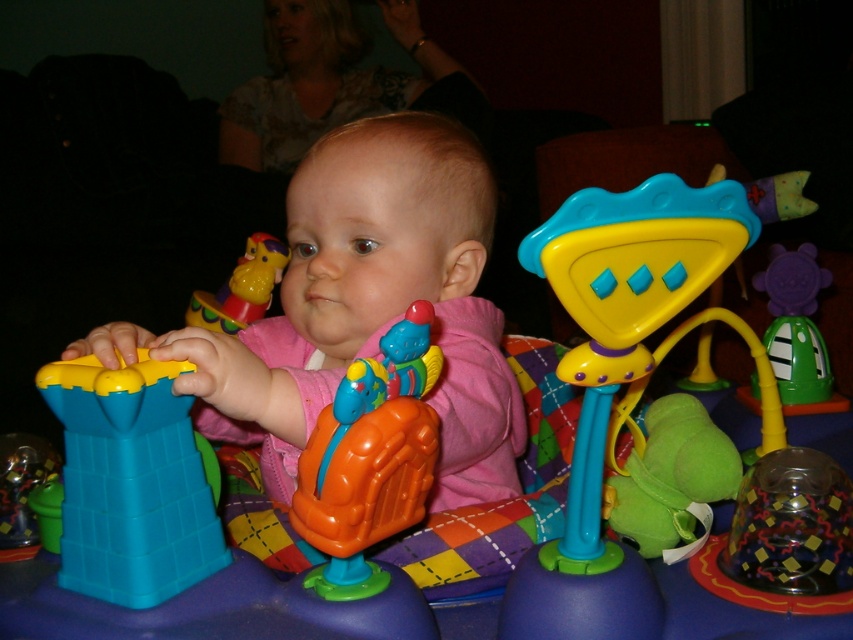
You are a parent trying to ensure the baby is safe while playing. Given the pink matte baby at center and the orange plastic toy at center, which object is more likely to be within the baby

The pink matte baby at center is larger in size than the orange plastic toy at center, so the orange plastic toy at center is more likely to be within the baby

You are a parent trying to ensure your baby stays within a safe distance from small toys to prevent choking hazards. According to the safety guidelines, the baby should be at least 12 inches away from any small toys. Are the pink matte baby at center and orange plastic toy at center within the safe distance?

The pink matte baby at center and orange plastic toy at center are 9.30 inches apart from each other, which is less than the required 12 inches for safety guidelines. Therefore, the distance is not safe.